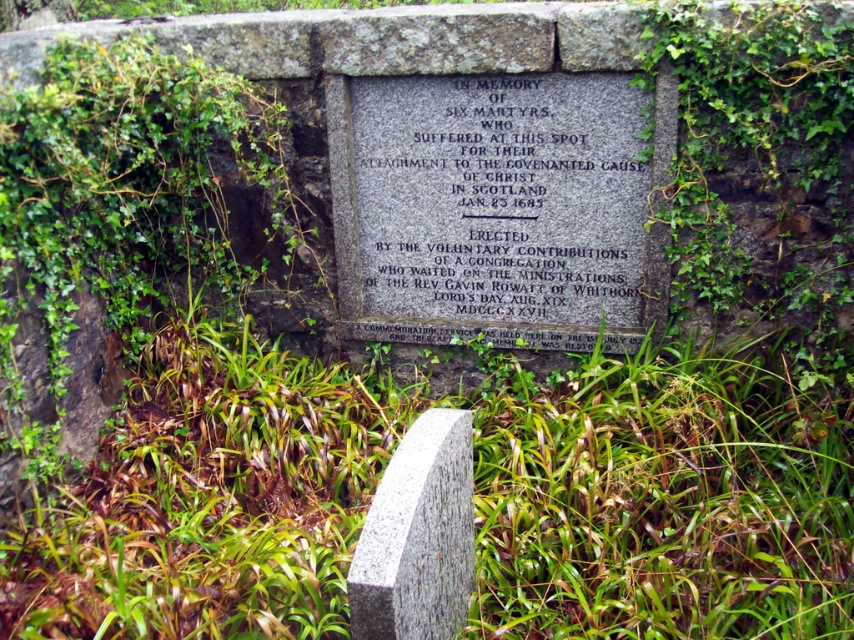
In the scene shown: You are a tour guide leading a group to the gray stone plaque at center and the granite gravestone at center. You want to place a 4 feet long banner between them. Will the banner fit between the two objects?

The gray stone plaque at center and granite gravestone at center are 3.74 feet apart from each other. Since the banner is 4 feet long, it will not fit between them as the distance is shorter than the banner.